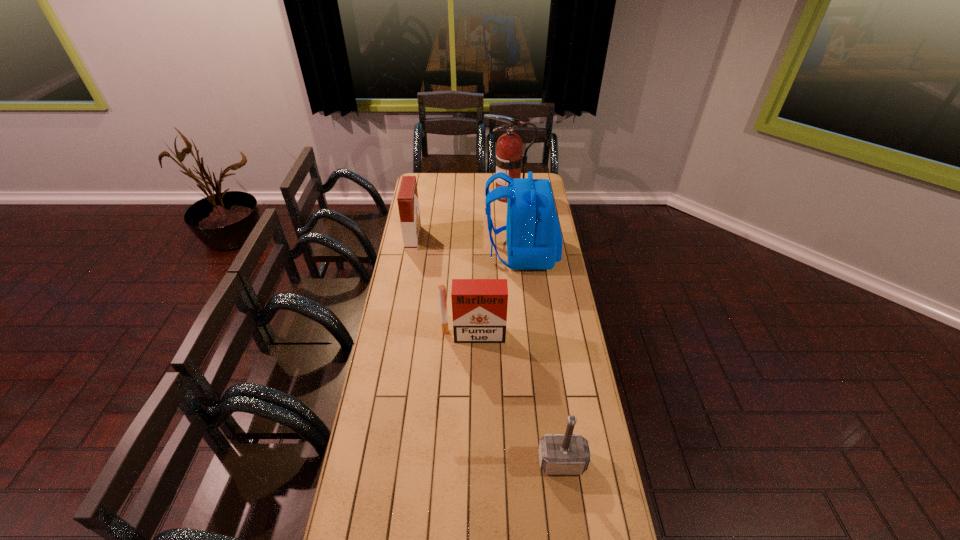
This screenshot has height=540, width=960. Find the location of `vacant position in the image that satisfies the following two spatial constraints: 1. on the back of the fourth shortest object; 2. on the front-facing side of the nearer cigarette case`. vacant position in the image that satisfies the following two spatial constraints: 1. on the back of the fourth shortest object; 2. on the front-facing side of the nearer cigarette case is located at coordinates (529, 335).